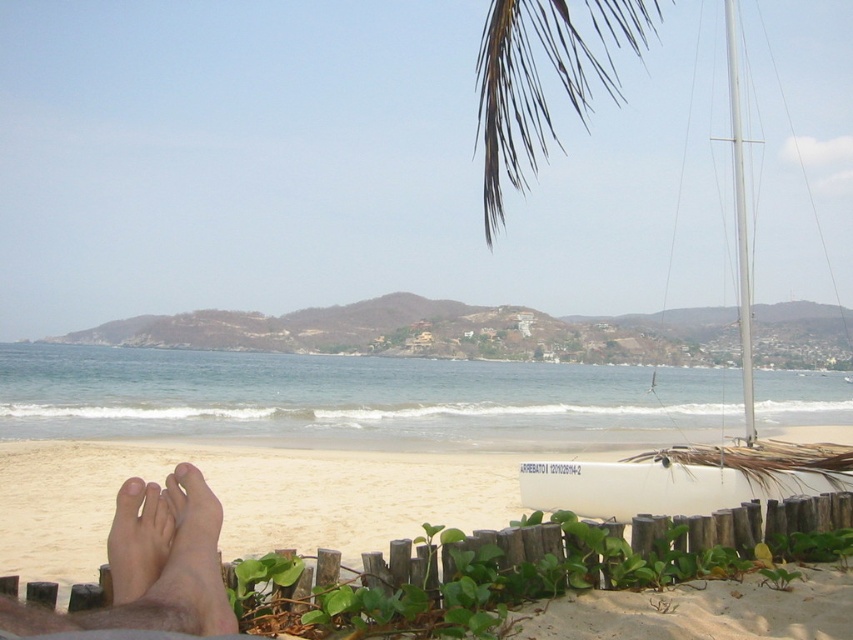
You are standing on the beach and see the white matte sailboat at right and the pale skin at lower left. Which object is closer to you?

The white matte sailboat at right is closer to you because the pale skin at lower left is behind it.

You are a photographer trying to capture the entire scene of the white matte sailboat at right and the skinny bare feet at lower left in one shot. Based on their sizes, which object would require you to adjust your camera angle to include more of the scene without cropping?

The white matte sailboat at right is wider than the skinny bare feet at lower left, so you would need to adjust your camera angle to include more of the sailboat without cropping.